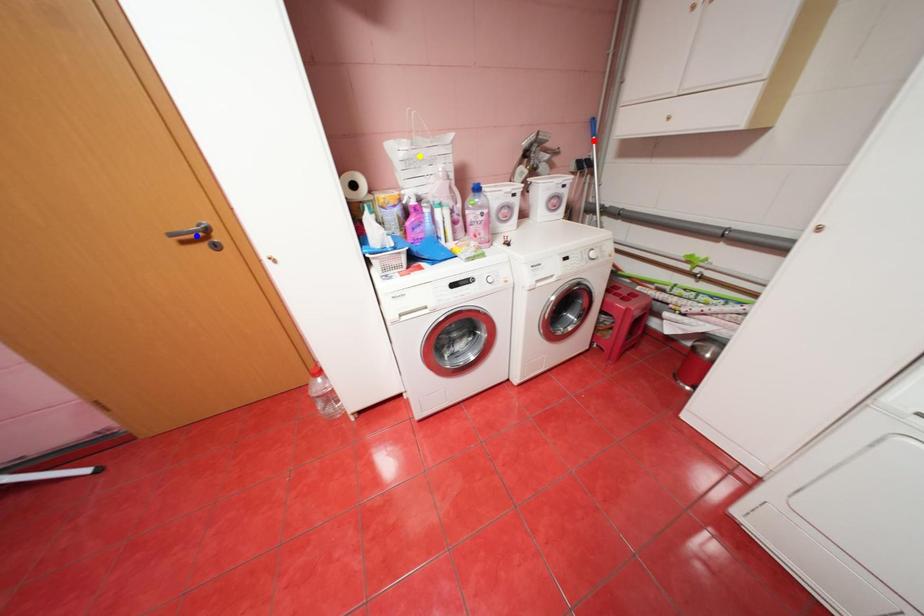
Looking at this image, order these from nearest to farthest:
red point, blue point, yellow point

1. blue point
2. yellow point
3. red point